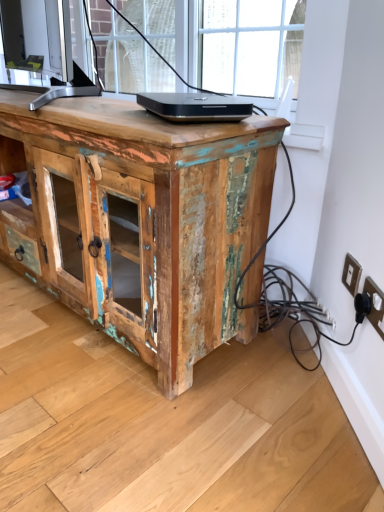
Question: Is white plastic electric outlet at lower right, the second electric outlet when ordered from front to back, positioned beyond the bounds of weathered wood cabinet at center?

Choices:
 (A) yes
 (B) no

Answer: (A)

Question: Does white plastic electric outlet at lower right, acting as the first electric outlet starting from the back, have a lesser height compared to weathered wood cabinet at center?

Choices:
 (A) no
 (B) yes

Answer: (B)

Question: Does white plastic electric outlet at lower right, the second electric outlet when ordered from front to back, appear on the left side of weathered wood cabinet at center?

Choices:
 (A) yes
 (B) no

Answer: (B)

Question: Is white plastic electric outlet at lower right, the second electric outlet when ordered from front to back, turned away from weathered wood cabinet at center?

Choices:
 (A) no
 (B) yes

Answer: (A)

Question: Considering the relative positions of white plastic electric outlet at lower right, acting as the first electric outlet starting from the back, and weathered wood cabinet at center in the image provided, is white plastic electric outlet at lower right, acting as the first electric outlet starting from the back, in front of weathered wood cabinet at center?

Choices:
 (A) no
 (B) yes

Answer: (A)

Question: Is black plastic electric outlet at lower right, the 2th electric outlet positioned from the back, to the left or to the right of white plastic electric outlet at lower right, acting as the first electric outlet starting from the back, in the image?

Choices:
 (A) right
 (B) left

Answer: (A)

Question: Which is correct: black plastic electric outlet at lower right, the 2th electric outlet positioned from the back, is inside white plastic electric outlet at lower right, the second electric outlet when ordered from front to back, or outside of it?

Choices:
 (A) outside
 (B) inside

Answer: (A)

Question: Considering the positions of black plastic electric outlet at lower right, the 2th electric outlet positioned from the back, and white plastic electric outlet at lower right, the second electric outlet when ordered from front to back, in the image, is black plastic electric outlet at lower right, the 2th electric outlet positioned from the back, taller or shorter than white plastic electric outlet at lower right, the second electric outlet when ordered from front to back,?

Choices:
 (A) tall
 (B) short

Answer: (A)

Question: From the image's perspective, is black plastic electric outlet at lower right, the first electric outlet positioned from the front, positioned above or below white plastic electric outlet at lower right, acting as the first electric outlet starting from the back?

Choices:
 (A) above
 (B) below

Answer: (B)

Question: Would you say white plastic electric outlet at lower right, acting as the first electric outlet starting from the back, is to the left or to the right of black plastic electric outlet at lower right, the 2th electric outlet positioned from the back, in the picture?

Choices:
 (A) left
 (B) right

Answer: (A)

Question: Considering the positions of white plastic electric outlet at lower right, the second electric outlet when ordered from front to back, and black plastic electric outlet at lower right, the first electric outlet positioned from the front, in the image, is white plastic electric outlet at lower right, the second electric outlet when ordered from front to back, taller or shorter than black plastic electric outlet at lower right, the first electric outlet positioned from the front,?

Choices:
 (A) short
 (B) tall

Answer: (A)

Question: Based on their sizes in the image, would you say white plastic electric outlet at lower right, acting as the first electric outlet starting from the back, is bigger or smaller than black plastic electric outlet at lower right, the first electric outlet positioned from the front?

Choices:
 (A) small
 (B) big

Answer: (A)

Question: Relative to black plastic electric outlet at lower right, the first electric outlet positioned from the front, is white plastic electric outlet at lower right, the second electric outlet when ordered from front to back, in front or behind?

Choices:
 (A) behind
 (B) front

Answer: (A)

Question: Is weathered wood cabinet at center bigger or smaller than black glossy laptop at center?

Choices:
 (A) small
 (B) big

Answer: (B)

Question: From the image's perspective, is weathered wood cabinet at center positioned above or below black glossy laptop at center?

Choices:
 (A) above
 (B) below

Answer: (B)